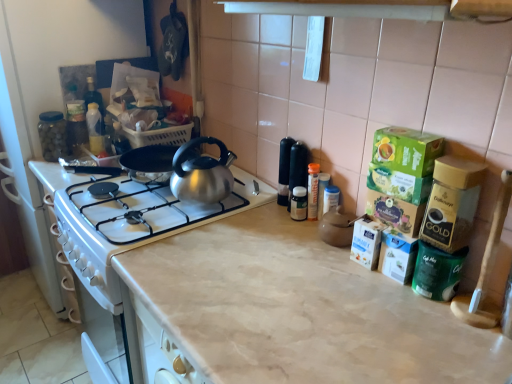
Locate an element on the screen. The width and height of the screenshot is (512, 384). free space above beige marble countertop at center (from a real-world perspective) is located at coordinates (273, 276).